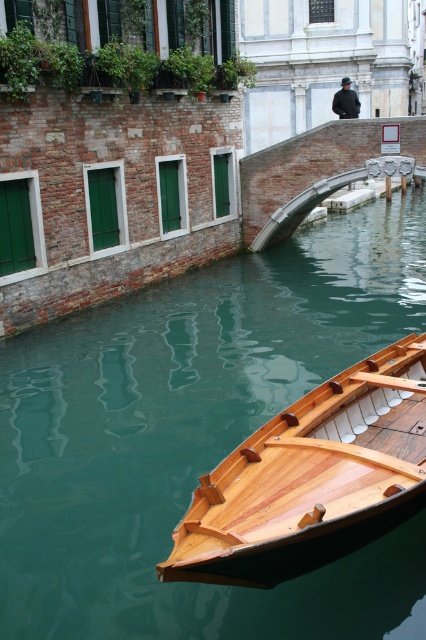
You are standing on the canal bridge and see the green smooth water at lower left and the shiny brown wood boat at lower right. Which object is taller from your viewpoint?

The green smooth water at lower left is taller than the shiny brown wood boat at lower right according to the description.

You are a tour guide leading a group along the canal. You want to ensure everyone can hear you clearly. The sound of your voice can travel 5 meters in this environment. Will your voice reach the shiny brown wood boat at lower right from your current position near the green smooth water at lower left?

The distance between the green smooth water at lower left and the shiny brown wood boat at lower right is 5.10 meters. Since the sound can only travel 5 meters, the voice will not reach the shiny brown wood boat at lower right.

You are standing at the point closest to the camera in this canal scene. Which point, point (121, 627) or point (414, 456), is closer to you?

Point (121, 627) is closer to you because it is in front of point (414, 456).